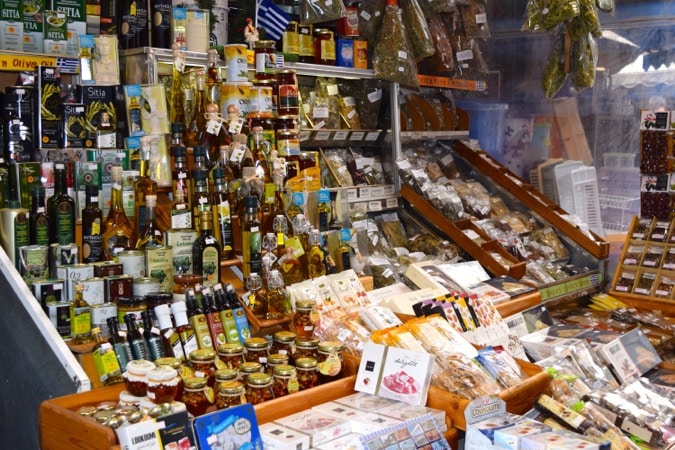
What are the coordinates of `wooden trays` in the screenshot? It's located at (59, 432), (453, 410), (511, 306), (484, 257), (566, 228), (639, 305), (611, 291).